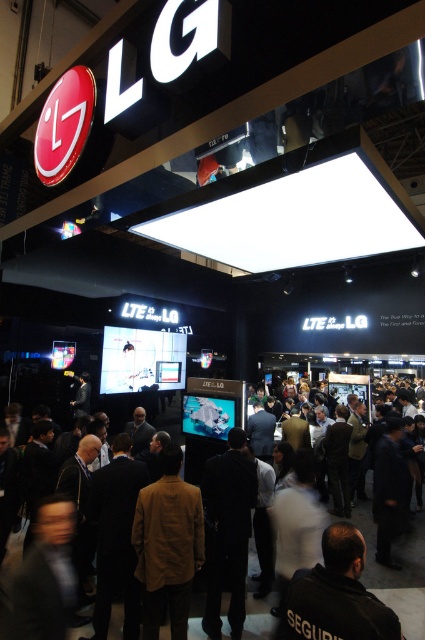
Does brown leather jacket at center appear on the left side of black leather jacket at lower center?

Correct, you'll find brown leather jacket at center to the left of black leather jacket at lower center.

Is brown leather jacket at center smaller than black leather jacket at lower center?

Yes.

Identify the location of brown leather jacket at center. (167, 545).

Where is `brown leather jacket at center`? brown leather jacket at center is located at coordinates (167, 545).

Consider the image. Is black leather jacket at lower center to the right of dark gray clothing at center from the viewer's perspective?

In fact, black leather jacket at lower center is to the left of dark gray clothing at center.

Locate an element on the screen. The width and height of the screenshot is (425, 640). black leather jacket at lower center is located at coordinates (337, 595).

Identify the location of black leather jacket at lower center. The width and height of the screenshot is (425, 640). (337, 595).

Which is in front, point (167, 589) or point (413, 573)?

Point (167, 589) is in front.

Between brown leather jacket at center and dark gray clothing at center, which one has less height?

With less height is dark gray clothing at center.

Image resolution: width=425 pixels, height=640 pixels. Identify the location of brown leather jacket at center. (167, 545).